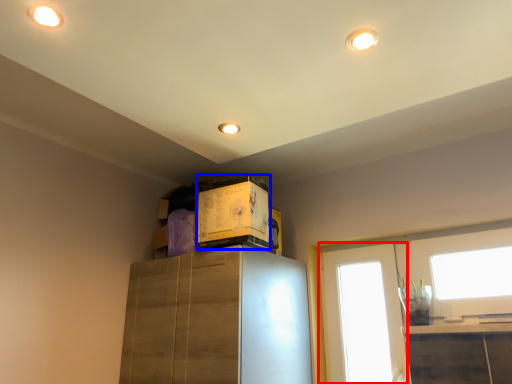
Question: Among these objects, which one is nearest to the camera, window (highlighted by a red box) or box (highlighted by a blue box)?

Choices:
 (A) window
 (B) box

Answer: (B)